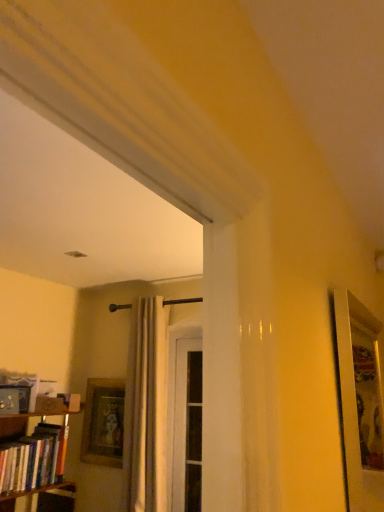
At what (x,y) coordinates should I click in order to perform the action: click on white sheer curtain at center. Please return your answer as a coordinate pair (x, y). Looking at the image, I should click on (148, 410).

What do you see at coordinates (103, 422) in the screenshot?
I see `wooden picture frame at lower left` at bounding box center [103, 422].

Where is `hardcover books at left`? The height and width of the screenshot is (512, 384). hardcover books at left is located at coordinates (33, 459).

Could you tell me if white wood screen door at center is facing wooden picture frame at lower left?

No, white wood screen door at center does not turn towards wooden picture frame at lower left.

Considering the relative sizes of white wood screen door at center and wooden picture frame at lower left in the image provided, is white wood screen door at center smaller than wooden picture frame at lower left?

Actually, white wood screen door at center might be larger than wooden picture frame at lower left.

Where is `picture frame above the white wood screen door at center (from a real-world perspective)`? The width and height of the screenshot is (384, 512). picture frame above the white wood screen door at center (from a real-world perspective) is located at coordinates (103, 422).

Can you confirm if white wood screen door at center is taller than wooden picture frame at lower left?

Indeed, white wood screen door at center has a greater height compared to wooden picture frame at lower left.

From a real-world perspective, is hardcover books at left physically below white sheer curtain at center?

Correct, in the physical world, hardcover books at left is lower than white sheer curtain at center.

Which object is wider, hardcover books at left or white sheer curtain at center?

Wider between the two is hardcover books at left.

Can you tell me how much hardcover books at left and white sheer curtain at center differ in facing direction?

They differ by 89.3 degrees in their facing directions.

In the image, is hardcover books at left positioned in front of or behind white sheer curtain at center?

In the image, hardcover books at left appears in front of white sheer curtain at center.

Does hardcover books at left touch wooden picture frame at lower left?

hardcover books at left and wooden picture frame at lower left are not in contact.

From the image's perspective, which one is positioned higher, hardcover books at left or wooden picture frame at lower left?

hardcover books at left.

Considering the positions of objects hardcover books at left and wooden picture frame at lower left in the image provided, who is more to the right, hardcover books at left or wooden picture frame at lower left?

wooden picture frame at lower left.

Can you confirm if hardcover books at left is shorter than wooden picture frame at lower left?

Yes, hardcover books at left is shorter than wooden picture frame at lower left.

From the image's perspective, is wooden picture frame at lower left on top of hardcover books at left?

Incorrect, from the image's perspective, wooden picture frame at lower left is lower than hardcover books at left.

Would you say hardcover books at left is part of wooden picture frame at lower left's contents?

No.

Is wooden picture frame at lower left positioned with its back to hardcover books at left?

No, wooden picture frame at lower left is not facing away from hardcover books at left.

From a real-world perspective, which object rests below the other?

wooden picture frame at lower left.

How different are the orientations of white sheer curtain at center and wooden picture frame at lower left in degrees?

1.31 degrees.

From the image's perspective, is white sheer curtain at center on wooden picture frame at lower left?

Yes, from the image's perspective, white sheer curtain at center is above wooden picture frame at lower left.

Are white sheer curtain at center and wooden picture frame at lower left located far from each other?

Actually, white sheer curtain at center and wooden picture frame at lower left are a little close together.

From a real-world perspective, is wooden picture frame at lower left beneath white wood screen door at center?

Actually, wooden picture frame at lower left is physically above white wood screen door at center in the real world.

Based on the photo, considering the relative sizes of wooden picture frame at lower left and white wood screen door at center in the image provided, is wooden picture frame at lower left wider than white wood screen door at center?

No, wooden picture frame at lower left is not wider than white wood screen door at center.

Is wooden picture frame at lower left looking in the opposite direction of white wood screen door at center?

No, wooden picture frame at lower left is not facing the opposite direction of white wood screen door at center.

Does wooden picture frame at lower left come in front of white wood screen door at center?

No, wooden picture frame at lower left is further to the viewer.

From a real-world perspective, relative to hardcover books at left, is white wood screen door at center vertically above or below?

Clearly, from a real-world perspective, white wood screen door at center is above hardcover books at left.

How different are the orientations of white wood screen door at center and hardcover books at left in degrees?

The angle between the facing direction of white wood screen door at center and the facing direction of hardcover books at left is 90.3 degrees.

Who is taller, white wood screen door at center or hardcover books at left?

white wood screen door at center is taller.

Where is `book to the left of white wood screen door at center`? book to the left of white wood screen door at center is located at coordinates (33, 459).

Image resolution: width=384 pixels, height=512 pixels. What are the coordinates of `picture frame above the white wood screen door at center (from a real-world perspective)` in the screenshot? It's located at (103, 422).

This screenshot has width=384, height=512. In order to click on book on the left of white sheer curtain at center in this screenshot , I will do `click(33, 459)`.

When comparing their distances from hardcover books at left, does white wood screen door at center or wooden picture frame at lower left seem closer?

wooden picture frame at lower left is closer to hardcover books at left.

Estimate the real-world distances between objects in this image. Which object is closer to wooden picture frame at lower left, white wood screen door at center or hardcover books at left?

The object closer to wooden picture frame at lower left is white wood screen door at center.

Which object lies further to the anchor point white wood screen door at center, wooden picture frame at lower left or white sheer curtain at center?

Among the two, wooden picture frame at lower left is located further to white wood screen door at center.

Looking at this image, looking at the image, which one is located closer to white wood screen door at center, wooden picture frame at lower left or hardcover books at left?

wooden picture frame at lower left is positioned closer to the anchor white wood screen door at center.

From the image, which object appears to be nearer to white sheer curtain at center, wooden picture frame at lower left or white wood screen door at center?

white wood screen door at center.

From the image, which object appears to be nearer to wooden picture frame at lower left, white wood screen door at center or white sheer curtain at center?

white sheer curtain at center is closer to wooden picture frame at lower left.

Based on the photo, considering their positions, is white wood screen door at center positioned further to hardcover books at left than white sheer curtain at center?

white wood screen door at center lies further to hardcover books at left than the other object.

Looking at the image, which one is located closer to white wood screen door at center, white sheer curtain at center or hardcover books at left?

white sheer curtain at center lies closer to white wood screen door at center than the other object.

Locate an element on the screen. The height and width of the screenshot is (512, 384). curtain located between wooden picture frame at lower left and white wood screen door at center in the left-right direction is located at coordinates (148, 410).

Locate an element on the screen. curtain positioned between hardcover books at left and wooden picture frame at lower left from near to far is located at coordinates (148, 410).

This screenshot has height=512, width=384. What are the coordinates of `curtain between hardcover books at left and white wood screen door at center in the horizontal direction` in the screenshot? It's located at (148, 410).

Where is `picture frame between hardcover books at left and white wood screen door at center from left to right`? picture frame between hardcover books at left and white wood screen door at center from left to right is located at coordinates (103, 422).